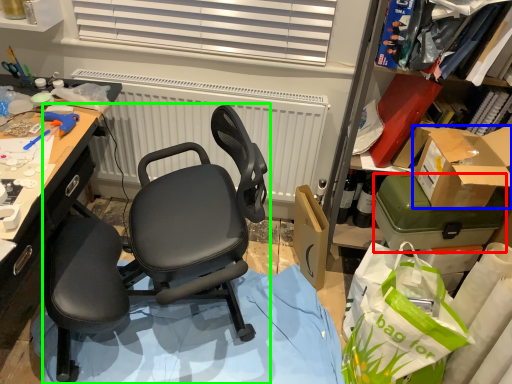
Question: Which is nearer to the box (highlighted by a red box)? box (highlighted by a blue box) or chair (highlighted by a green box).

Choices:
 (A) box
 (B) chair

Answer: (A)